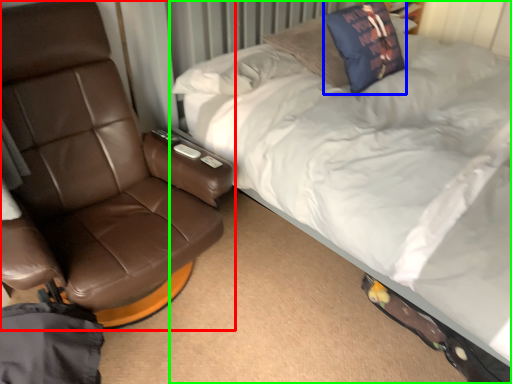
Question: Based on their relative distances, which object is nearer to chair (highlighted by a red box)? Choose from throw pillow (highlighted by a blue box) and bed (highlighted by a green box).

Choices:
 (A) throw pillow
 (B) bed

Answer: (B)